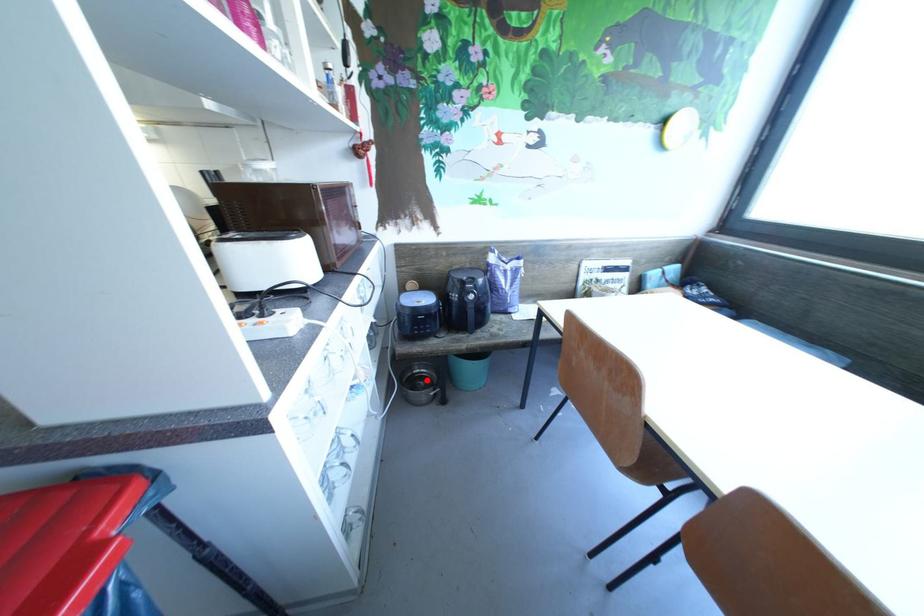
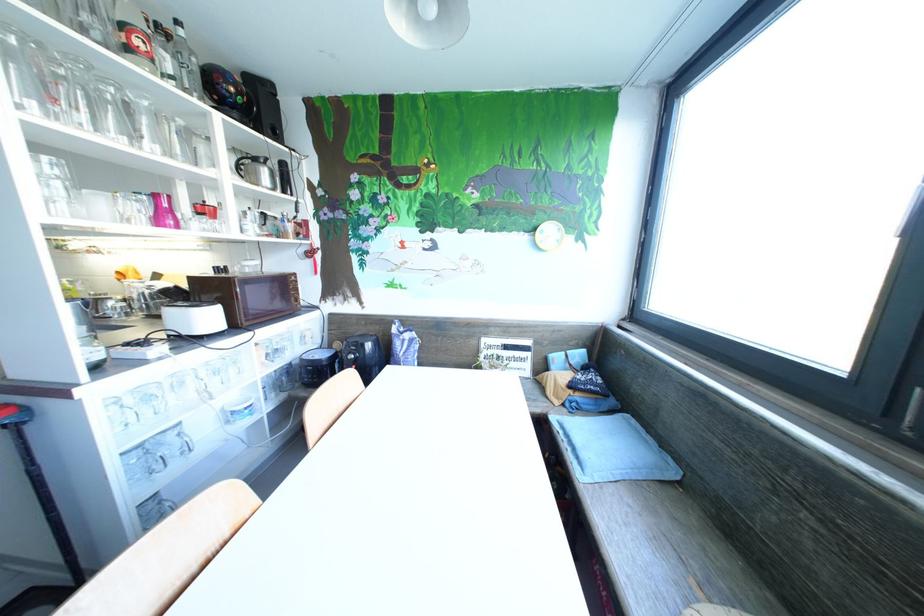
Question: I am providing you with two images of the same scene from different viewpoints. A red point is marked on the first image. Can you still see the location of the red point in image 2?

Choices:
 (A) Yes
 (B) No

Answer: (B)